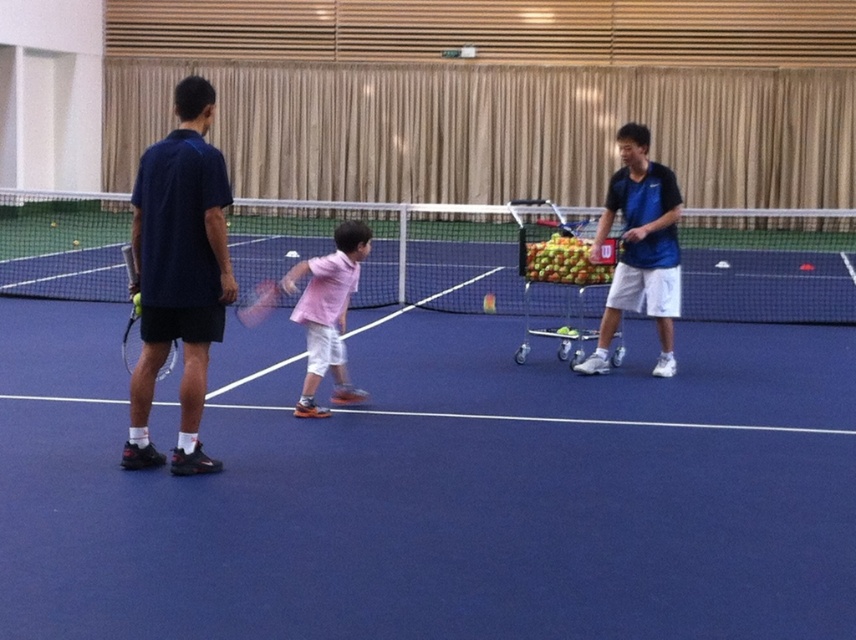
Does blue synthetic tennis court at center come behind green matte tennis ball at center?

That is False.

Who is positioned more to the right, blue synthetic tennis court at center or green matte tennis ball at center?

From the viewer's perspective, blue synthetic tennis court at center appears more on the right side.

This screenshot has width=856, height=640. Find the location of `blue synthetic tennis court at center`. blue synthetic tennis court at center is located at coordinates (413, 458).

The image size is (856, 640). I want to click on blue synthetic tennis court at center, so click(413, 458).

Does blue synthetic tennis court at center appear on the right side of white mesh net at center?

Yes, blue synthetic tennis court at center is to the right of white mesh net at center.

From the picture: Can you confirm if blue synthetic tennis court at center is wider than white mesh net at center?

Incorrect, blue synthetic tennis court at center's width does not surpass white mesh net at center's.

Is point (512, 464) less distant than point (28, 228)?

Yes, point (512, 464) is in front of point (28, 228).

Find the location of a particular element. blue synthetic tennis court at center is located at coordinates (413, 458).

Does blue synthetic tennis court at center appear on the right side of blue matte tennis cart at right?

Yes, blue synthetic tennis court at center is to the right of blue matte tennis cart at right.

Who is more forward, [349,627] or [664,180]?

Point [349,627] is in front.

Locate an element on the screen. This screenshot has width=856, height=640. blue synthetic tennis court at center is located at coordinates (413, 458).